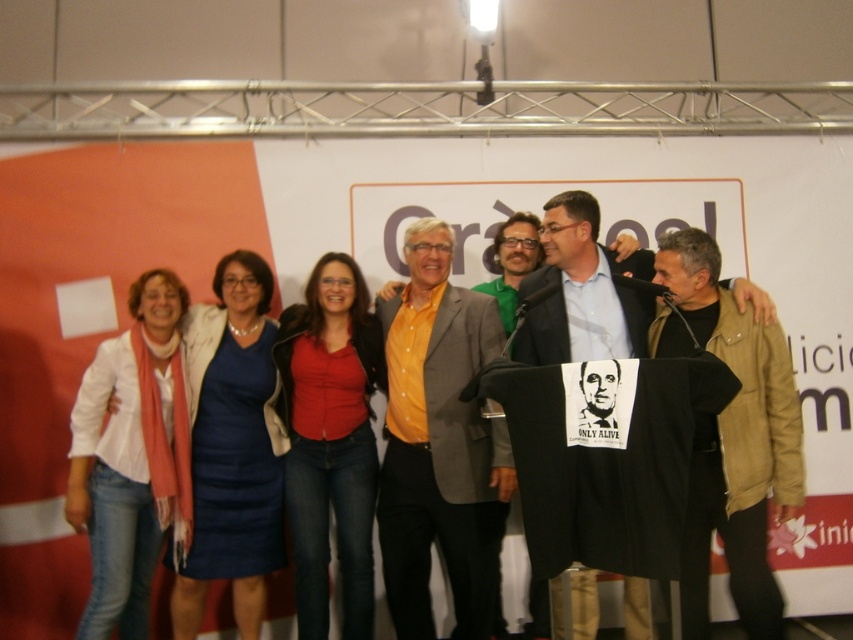
Is yellow cotton shirt at center above brown leather jacket at right?

Incorrect, yellow cotton shirt at center is not positioned above brown leather jacket at right.

Can you confirm if yellow cotton shirt at center is shorter than brown leather jacket at right?

Incorrect, yellow cotton shirt at center's height does not fall short of brown leather jacket at right's.

Is point (421, 310) more distant than point (759, 396)?

Yes, it is.

Where is `yellow cotton shirt at center`? The image size is (853, 640). yellow cotton shirt at center is located at coordinates (438, 444).

Who is higher up, white matte scarf at left or blue dress at center?

blue dress at center

What do you see at coordinates (131, 458) in the screenshot? I see `white matte scarf at left` at bounding box center [131, 458].

Find the location of a particular element. This screenshot has height=640, width=853. white matte scarf at left is located at coordinates (131, 458).

Is brown leather jacket at right thinner than white matte scarf at left?

No, brown leather jacket at right is not thinner than white matte scarf at left.

Who is more distant from viewer, (723, 509) or (189, 540)?

Point (189, 540)

Where is `brown leather jacket at right`? The height and width of the screenshot is (640, 853). brown leather jacket at right is located at coordinates pyautogui.click(x=734, y=444).